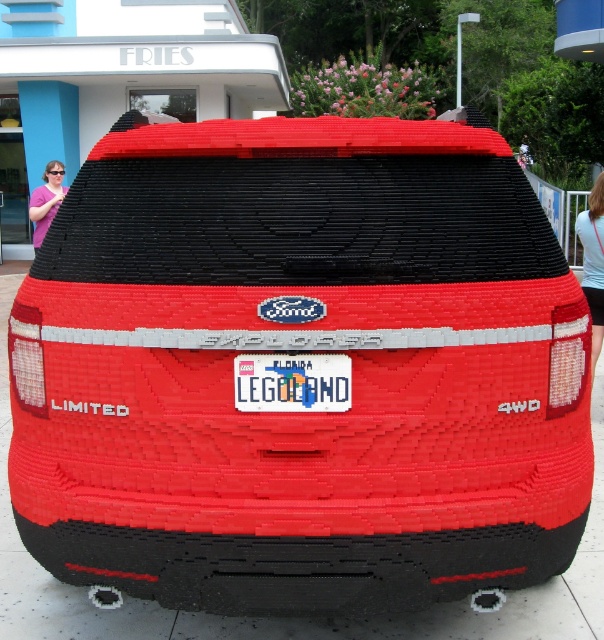
You are a visitor at LEGOLAND and see the rear of the Ford Explorer model. You notice the white plastic license plate at center and the blue denim shorts at lower right. Which object is located higher up on the vehicle?

The white plastic license plate at center is positioned under the blue denim shorts at lower right, meaning the blue denim shorts at lower right is higher up on the vehicle.

You are standing in front of the LEGO Ford Explorer model and notice an object labeled as blue denim shorts at lower right. Based on its coordinates, can you determine if this object is positioned closer to the bottom edge of the image compared to the center?

The blue denim shorts at lower right is located at point coordinates of 0.411 on the x axis and 0.983 on the y axis. Since the y coordinate is 0.983, which is closer to 1.0, it means the object is near the bottom edge of the image. Therefore, the blue denim shorts at lower right is positioned closer to the bottom edge than the center.

Consider the image. You are a toy designer examining the LEGO model of the Ford Explorer. You need to determine if the white plastic license plate at center can be replaced with a larger version without affecting the structural integrity of the car. The pink fabric sunglasses at left are currently occupying some space. Can the license plate be upsized?

The white plastic license plate at center is smaller than the pink fabric sunglasses at left, so there is space available to make the license plate larger without compromising the structural integrity of the car.